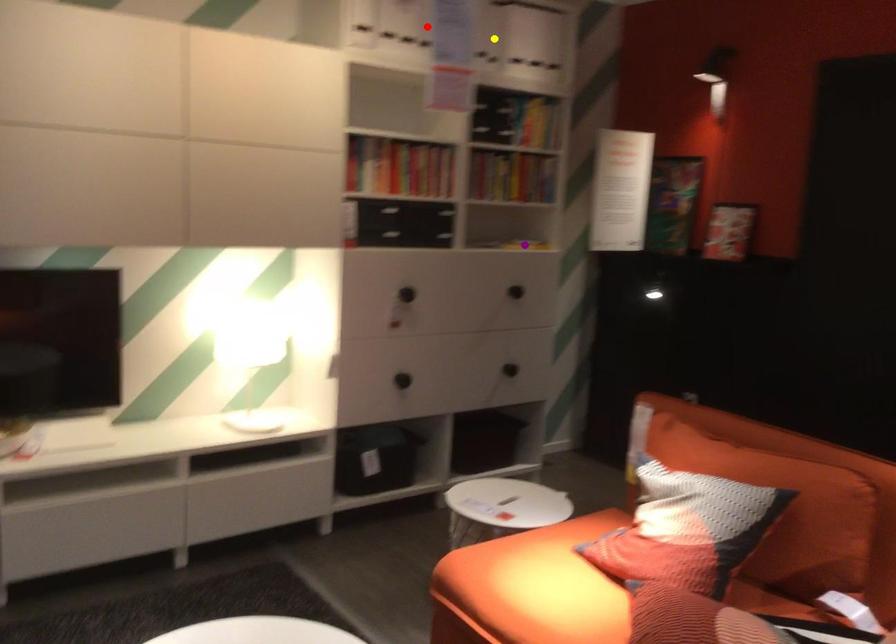
Order these from nearest to farthest:
red point
yellow point
purple point

red point < yellow point < purple point